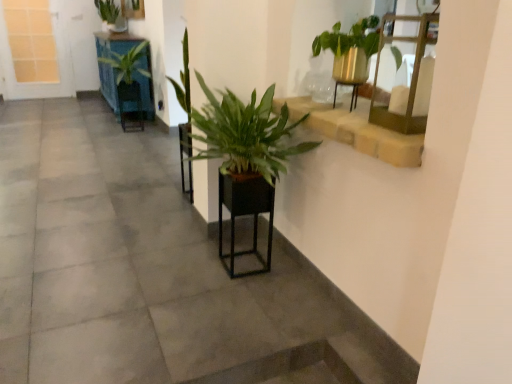
Question: Is black matte planter at center, placed as the first armchair when sorted from bottom to top, looking in the opposite direction of smooth concrete at center?

Choices:
 (A) yes
 (B) no

Answer: (B)

Question: From a real-world perspective, is black matte planter at center, the 3th armchair positioned from the back, beneath smooth concrete at center?

Choices:
 (A) no
 (B) yes

Answer: (A)

Question: Are black matte planter at center, marked as the third armchair in a left-to-right arrangement, and smooth concrete at center far apart?

Choices:
 (A) no
 (B) yes

Answer: (A)

Question: Is black matte planter at center, which ranks as the first armchair in front-to-back order, touching smooth concrete at center?

Choices:
 (A) no
 (B) yes

Answer: (A)

Question: Does black matte planter at center, which ranks as the first armchair in right-to-left order, have a lesser height compared to smooth concrete at center?

Choices:
 (A) no
 (B) yes

Answer: (A)

Question: From a real-world perspective, is black matte planter at center, the 3th armchair positioned from the back, on top of smooth concrete at center?

Choices:
 (A) no
 (B) yes

Answer: (B)

Question: From a real-world perspective, is matte black armchair at center, placed as the third armchair when sorted from right to left, positioned under green leafy plant at upper left, which ranks as the 2th houseplant in top-to-bottom order, based on gravity?

Choices:
 (A) yes
 (B) no

Answer: (A)

Question: Is matte black armchair at center, the third armchair viewed from the front, at the left side of green leafy plant at upper left, placed as the second houseplant when sorted from front to back?

Choices:
 (A) no
 (B) yes

Answer: (A)

Question: Is matte black armchair at center, which is the first armchair in top-to-bottom order, taller than green leafy plant at upper left, which ranks as the 2th houseplant in bottom-to-top order?

Choices:
 (A) no
 (B) yes

Answer: (A)

Question: Is matte black armchair at center, which is the first armchair in top-to-bottom order, not inside green leafy plant at upper left, which ranks as the 2th houseplant in bottom-to-top order?

Choices:
 (A) yes
 (B) no

Answer: (A)

Question: Can you see matte black armchair at center, which ranks as the third armchair in bottom-to-top order, touching green leafy plant at upper left, which ranks as the 2th houseplant in top-to-bottom order?

Choices:
 (A) yes
 (B) no

Answer: (B)

Question: Is green leafy plant at upper left, placed as the 2th houseplant when sorted from right to left, at the back of matte black armchair at center, the third armchair viewed from the front?

Choices:
 (A) no
 (B) yes

Answer: (A)

Question: From the image's perspective, is green leafy plant at upper left, which appears as the 1th houseplant when viewed from the back, under black matte planter at center, the 3th armchair positioned from the back?

Choices:
 (A) yes
 (B) no

Answer: (B)